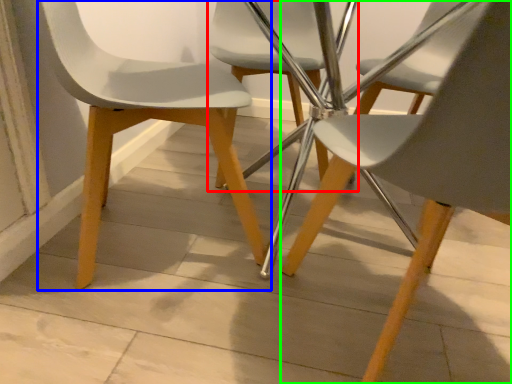
Question: Estimate the real-world distances between objects in this image. Which object is farther from chair (highlighted by a red box), chair (highlighted by a blue box) or chair (highlighted by a green box)?

Choices:
 (A) chair
 (B) chair

Answer: (B)